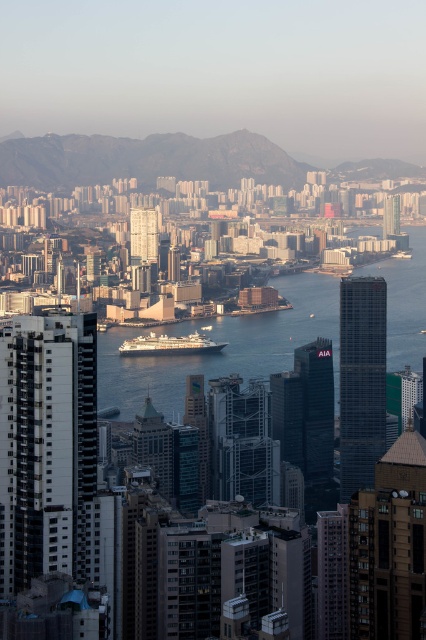
Question: Which point is farther to the camera?

Choices:
 (A) (104, 356)
 (B) (155, 141)
 (C) (120, 344)

Answer: (B)

Question: Does rocky mountain at upper center have a greater width compared to white glossy cruise ship at center?

Choices:
 (A) yes
 (B) no

Answer: (A)

Question: Is clear blue water at center below rocky mountain at upper center?

Choices:
 (A) yes
 (B) no

Answer: (A)

Question: Can you confirm if clear blue water at center is smaller than rocky mountain at upper center?

Choices:
 (A) no
 (B) yes

Answer: (A)

Question: Which object is closer to the camera taking this photo?

Choices:
 (A) white glossy cruise ship at center
 (B) rocky mountain at upper center

Answer: (A)

Question: Which point is farther from the camera taking this photo?

Choices:
 (A) (222, 346)
 (B) (43, 164)
 (C) (115, 401)

Answer: (B)